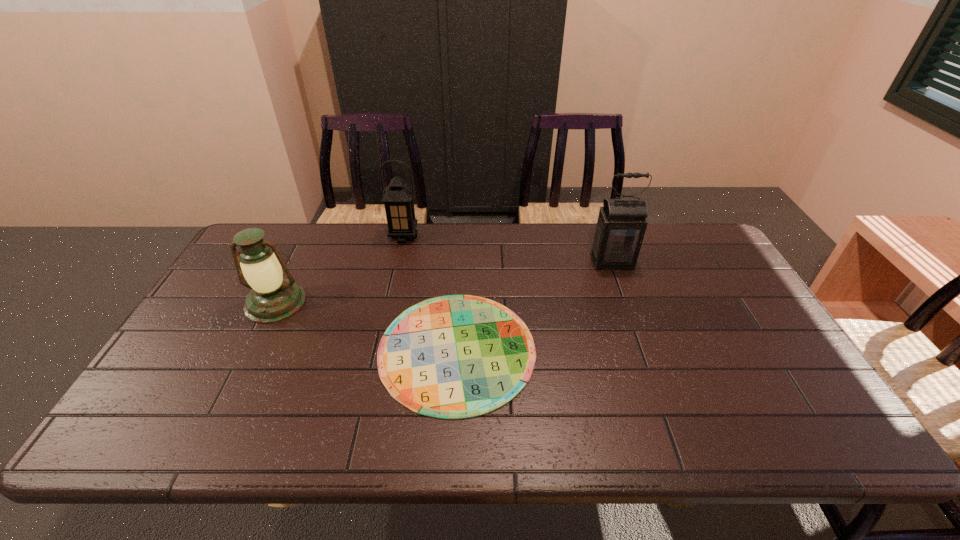
Locate an element on the screen. vacant space that is in between the shortest object and the farthest lantern is located at coordinates (430, 293).

Where is `free spot between the nearest lantern and the farthest object`? Image resolution: width=960 pixels, height=540 pixels. free spot between the nearest lantern and the farthest object is located at coordinates (340, 269).

This screenshot has height=540, width=960. I want to click on vacant space that is in between the second farthest object and the leftmost lantern, so click(444, 282).

At what (x,y) coordinates should I click in order to perform the action: click on free space between the leftmost lantern and the farthest lantern. Please return your answer as a coordinate pair (x, y). Looking at the image, I should click on (340, 269).

What are the coordinates of `free spot between the farthest lantern and the second farthest object` in the screenshot? It's located at (508, 249).

Where is `vacant region between the farthest lantern and the gameboard`? vacant region between the farthest lantern and the gameboard is located at coordinates (430, 293).

I want to click on free space between the rightmost object and the second lantern from right to left, so click(508, 249).

Locate an element on the screen. free space between the leftmost lantern and the second farthest lantern is located at coordinates (444, 282).

Point out which object is positioned as the second nearest to the rightmost object. Please provide its 2D coordinates. Your answer should be formatted as a tuple, i.e. [(x, y)], where the tuple contains the x and y coordinates of a point satisfying the conditions above.

[(398, 197)]

Identify the location of object that ranks as the closest to the farthest lantern. (457, 356).